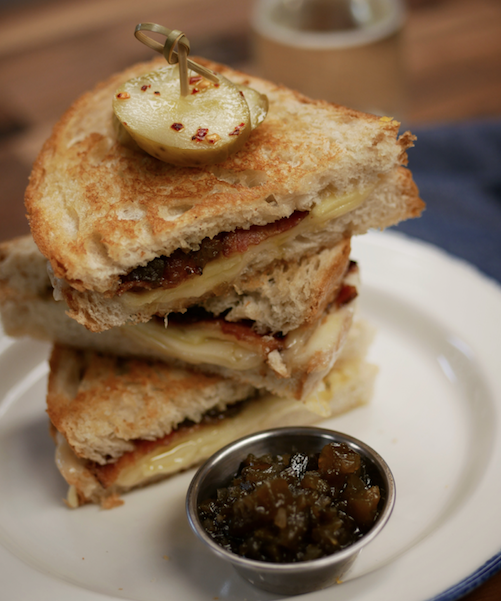
At what (x,y) coordinates should I click in order to perform the action: click on plate. Please return your answer as a coordinate pair (x, y). This screenshot has width=501, height=601. Looking at the image, I should click on (164, 554).